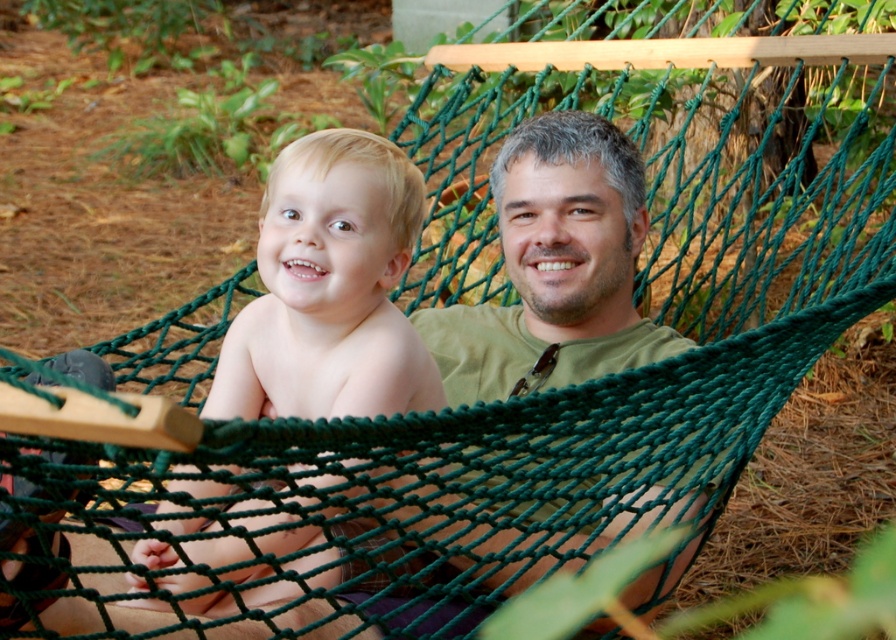
You are a drone operator trying to capture aerial footage of two points in the scene. The first point is labeled as point (586, 269) and the second is point (320, 243). From the perspective of the camera, which point is closer to the front of the scene?

Point (320, 243) is closer to the front of the scene because it is in front of point (586, 269).

You are a photographer trying to capture a closeup shot of the blonde hair baby at center without including the green fabric hammock at center in the frame. Is this possible given their relative sizes?

The green fabric hammock at center is wider than the blonde hair baby at center, so it might be challenging to frame the shot without including the hammock. Adjust your angle or position to focus solely on the baby.